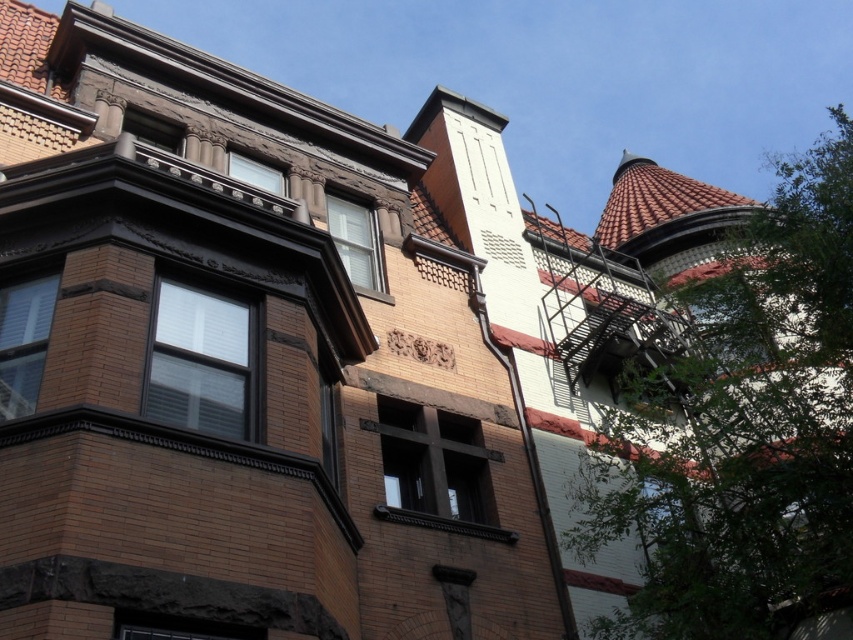
Which of these two, matte brown window at left or matte brown window at lower center, stands taller?

matte brown window at lower center is taller.

Is matte brown window at left to the right of matte brown window at lower center from the viewer's perspective?

In fact, matte brown window at left is to the left of matte brown window at lower center.

At what (x,y) coordinates should I click in order to perform the action: click on matte brown window at left. Please return your answer as a coordinate pair (x, y). Looking at the image, I should click on (22, 340).

Looking at this image, is matte glass window at upper center behind matte brown window at lower center?

Yes, matte glass window at upper center is further from the viewer.

Which is more to the left, matte glass window at upper center or matte brown window at lower center?

Positioned to the left is matte brown window at lower center.

Is point (337, 220) positioned in front of point (225, 634)?

No, (337, 220) is behind (225, 634).

This screenshot has width=853, height=640. I want to click on matte glass window at upper center, so click(355, 241).

Is transparent glass window at lower right thinner than matte glass window at upper center?

No, transparent glass window at lower right is not thinner than matte glass window at upper center.

Locate an element on the screen. transparent glass window at lower right is located at coordinates (669, 524).